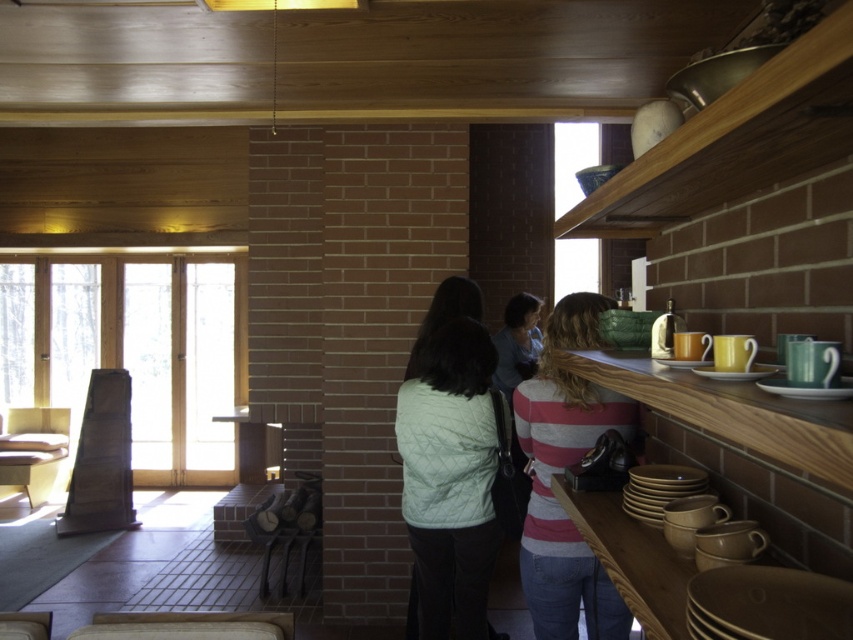
Question: Which is farther from the light green quilted vest at center?

Choices:
 (A) matte brown plate at shelf center
 (B) striped cotton shirt at upper right

Answer: (A)

Question: From the image, what is the correct spatial relationship of light green quilted vest at center in relation to striped cotton shirt at upper right?

Choices:
 (A) left
 (B) right

Answer: (A)

Question: Does light green quilted jacket at center appear over matte brown plate at shelf center?

Choices:
 (A) yes
 (B) no

Answer: (B)

Question: Which object is the farthest from the matte brown plate at shelf center?

Choices:
 (A) matte yellow plate at upper right
 (B) striped cotton shirt at upper right
 (C) light green quilted jacket at center
 (D) light green quilted vest at center

Answer: (C)

Question: Is light green quilted vest at center positioned at the back of matte yellow plate at upper right?

Choices:
 (A) no
 (B) yes

Answer: (B)

Question: Among these objects, which one is nearest to the camera?

Choices:
 (A) matte brown plate at shelf center
 (B) light green quilted vest at center
 (C) matte yellow plate at upper right
 (D) light green quilted jacket at center

Answer: (A)